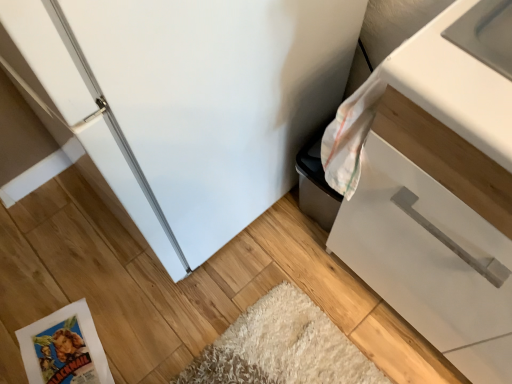
This screenshot has height=384, width=512. I want to click on empty space that is ontop of white paper comic book at lower left, so click(60, 350).